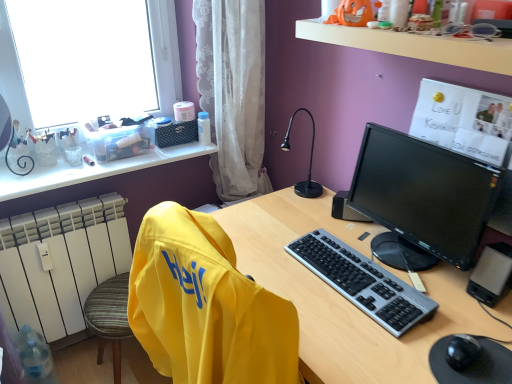
Find the location of a particular element. Image resolution: width=512 pixels, height=384 pixels. vacant area located to the right-hand side of black rubber mouse at lower right is located at coordinates (494, 337).